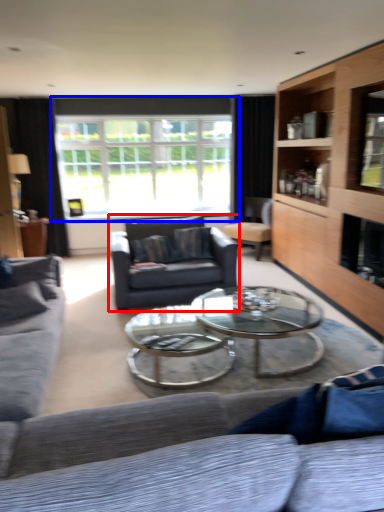
Question: Which point is further to the camera, swivel chair (highlighted by a red box) or window (highlighted by a blue box)?

Choices:
 (A) swivel chair
 (B) window

Answer: (B)